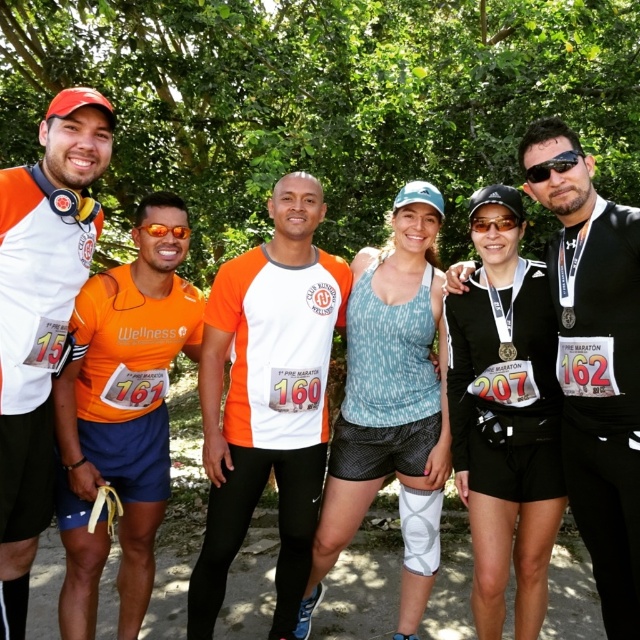
You are a photographer at the running event and want to capture both black matte sunglasses at upper right and black matte sunglasses at center in a single shot. Which sunglasses are positioned to the right side of the other?

The black matte sunglasses at upper right are positioned to the right of black matte sunglasses at center.

You are standing at the origin point in the image and want to reach the person wearing the blue tank top. The two points you can choose to move through are point (x=564, y=157) and point (x=474, y=220). Which point should you go through first to reach the blue tank top wearer more quickly?

You should go through point (x=564, y=157) first because it is in front of point (x=474, y=220), so taking that path would be shorter.